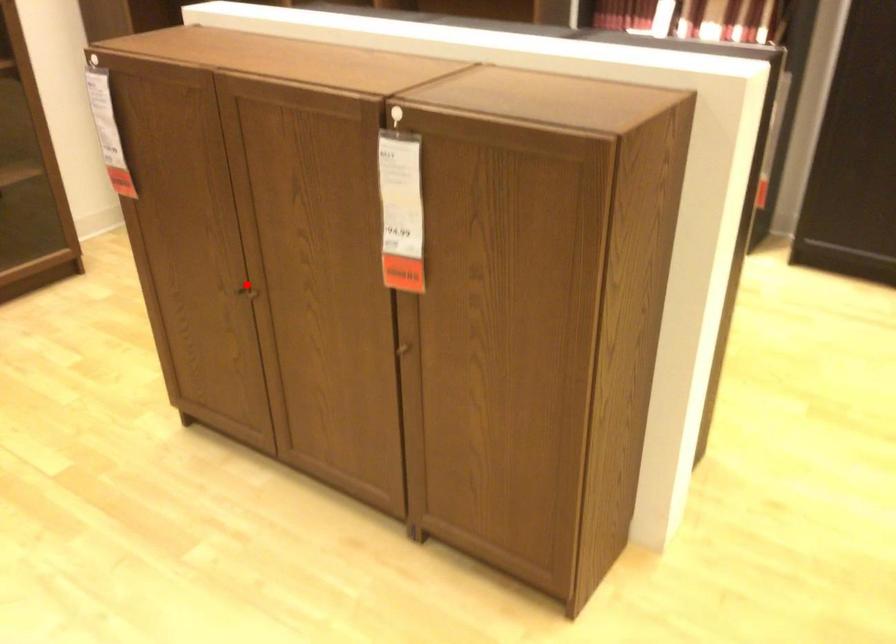
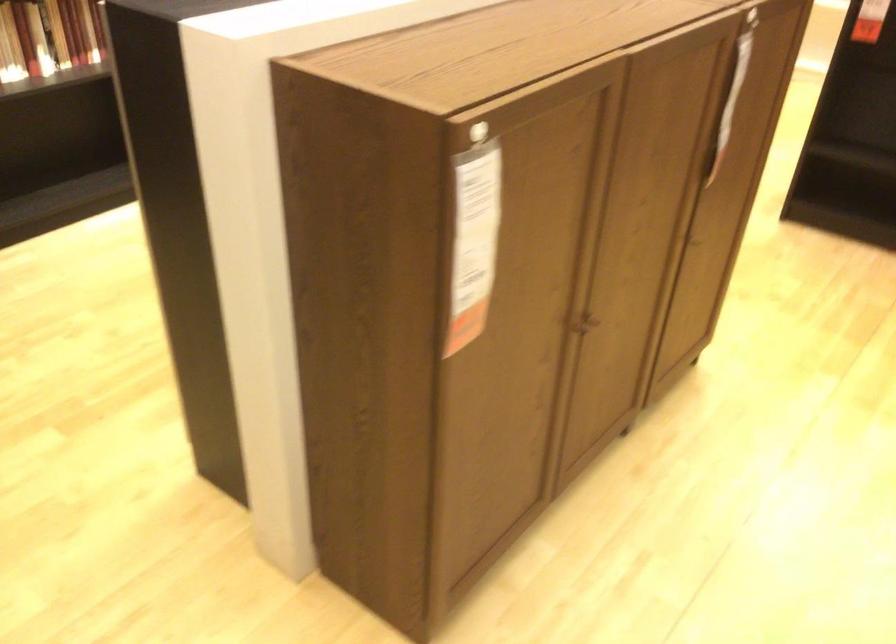
Question: I am providing you with two images of the same scene from different viewpoints. A red point is shown in image1. For the corresponding object point in image2, is it positioned nearer or farther from the camera?

Choices:
 (A) Nearer
 (B) Farther

Answer: (A)